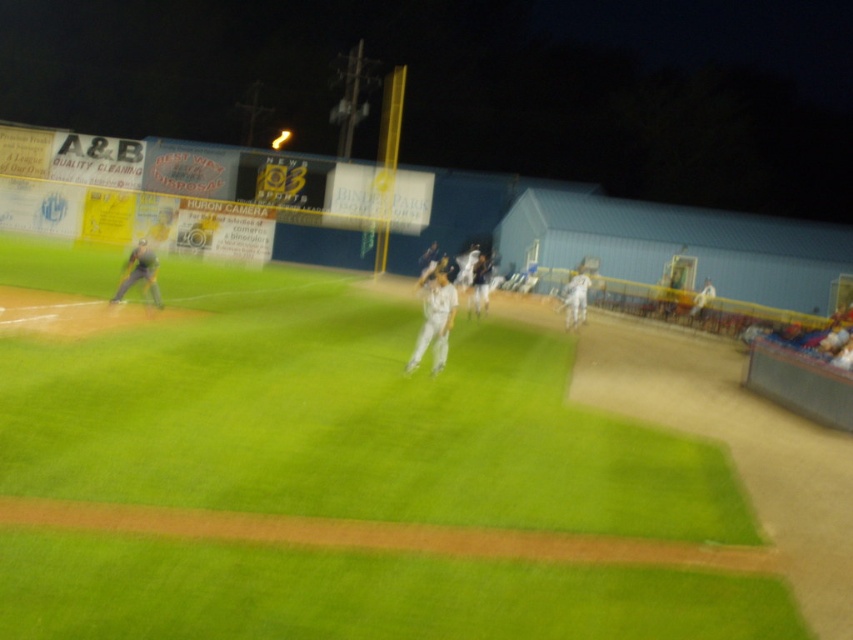
You are a photographer standing at the center of the field. You want to take a photo that includes both the point at coordinates point (434, 301) and point (137, 273). Which point will appear larger in the photo?

Point (434, 301) is closer to the camera than point (137, 273), so it will appear larger in the photo.

You are a photographer positioned at the center of the field. You want to take a photo of the white uniform at center. Where should you point your camera to capture the subject?

You should point your camera towards the coordinates point (434, 321) to capture the white uniform at center.